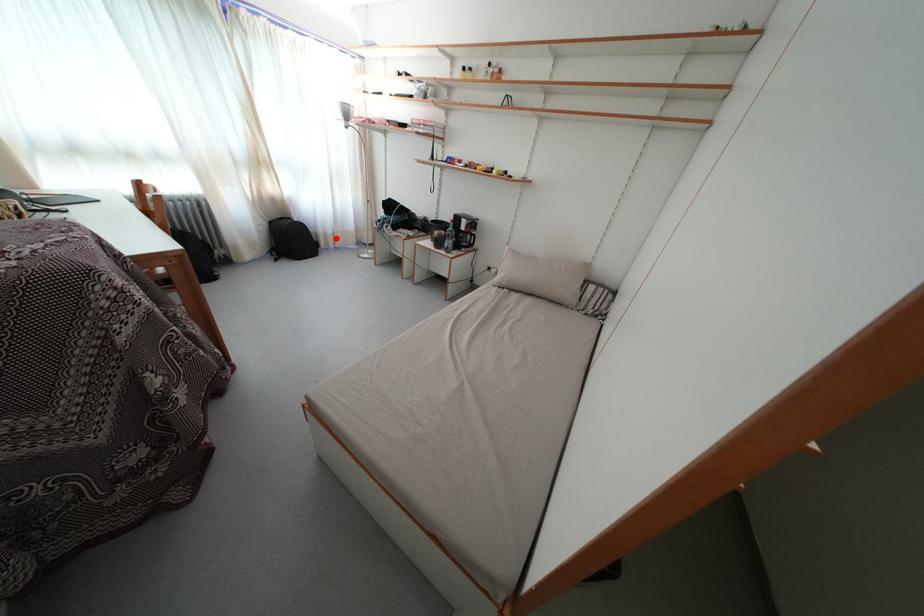
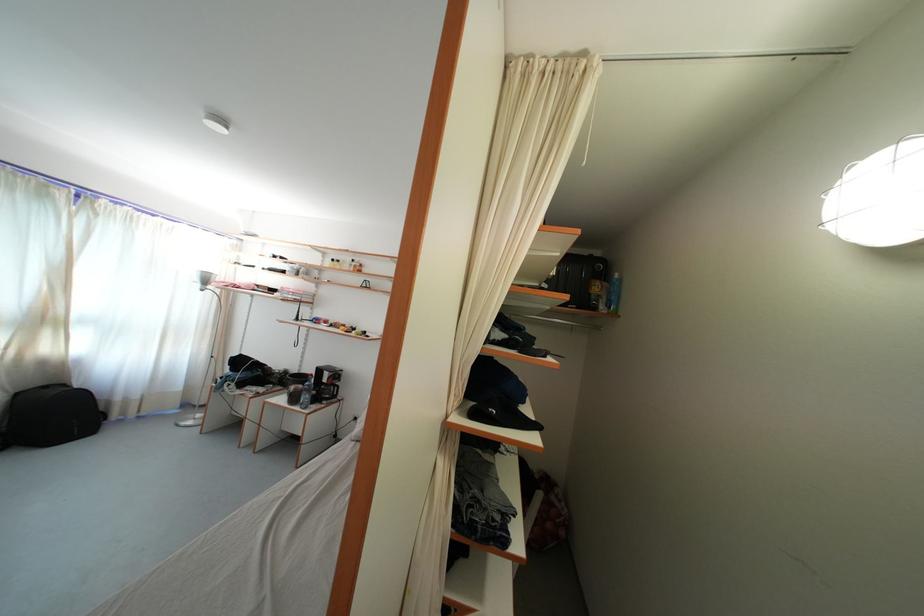
Question: I am providing you with two images of the same scene from different viewpoints. A red point is marked on the first image. Is the red point's position out of view in image 2?

Choices:
 (A) Yes
 (B) No

Answer: (B)